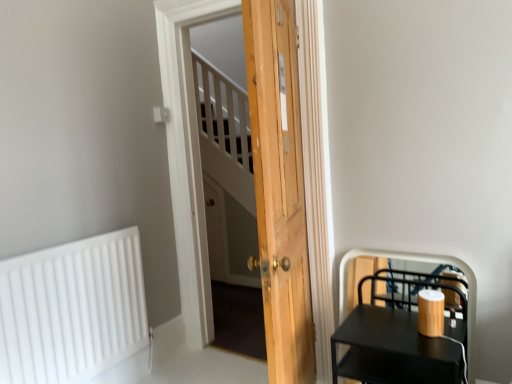
Question: Can you confirm if black matte side table at lower right is thinner than white matte radiator at lower left?

Choices:
 (A) no
 (B) yes

Answer: (A)

Question: Is black matte side table at lower right oriented towards white matte radiator at lower left?

Choices:
 (A) yes
 (B) no

Answer: (B)

Question: From the image's perspective, is black matte side table at lower right on white matte radiator at lower left?

Choices:
 (A) yes
 (B) no

Answer: (B)

Question: Does black matte side table at lower right have a lesser height compared to white matte radiator at lower left?

Choices:
 (A) yes
 (B) no

Answer: (A)

Question: From a real-world perspective, is black matte side table at lower right located higher than white matte radiator at lower left?

Choices:
 (A) yes
 (B) no

Answer: (B)

Question: Is point (136, 246) closer or farther from the camera than point (437, 350)?

Choices:
 (A) closer
 (B) farther

Answer: (B)

Question: Based on their sizes in the image, would you say white matte radiator at lower left is bigger or smaller than black matte side table at lower right?

Choices:
 (A) small
 (B) big

Answer: (A)

Question: Considering their positions, is white matte radiator at lower left located in front of or behind black matte side table at lower right?

Choices:
 (A) behind
 (B) front

Answer: (A)

Question: Is white matte radiator at lower left taller or shorter than black matte side table at lower right?

Choices:
 (A) short
 (B) tall

Answer: (B)

Question: From a real-world perspective, is natural wood door at center physically located above or below white matte radiator at lower left?

Choices:
 (A) above
 (B) below

Answer: (A)

Question: From the image's perspective, is natural wood door at center positioned above or below white matte radiator at lower left?

Choices:
 (A) above
 (B) below

Answer: (A)

Question: In terms of size, does natural wood door at center appear bigger or smaller than white matte radiator at lower left?

Choices:
 (A) big
 (B) small

Answer: (A)

Question: In terms of width, does natural wood door at center look wider or thinner when compared to white matte radiator at lower left?

Choices:
 (A) wide
 (B) thin

Answer: (A)

Question: From the image's perspective, is natural wood door at center above or below black matte side table at lower right?

Choices:
 (A) above
 (B) below

Answer: (A)

Question: Is point coord(295,125) positioned closer to the camera than point coord(361,347)?

Choices:
 (A) closer
 (B) farther

Answer: (B)